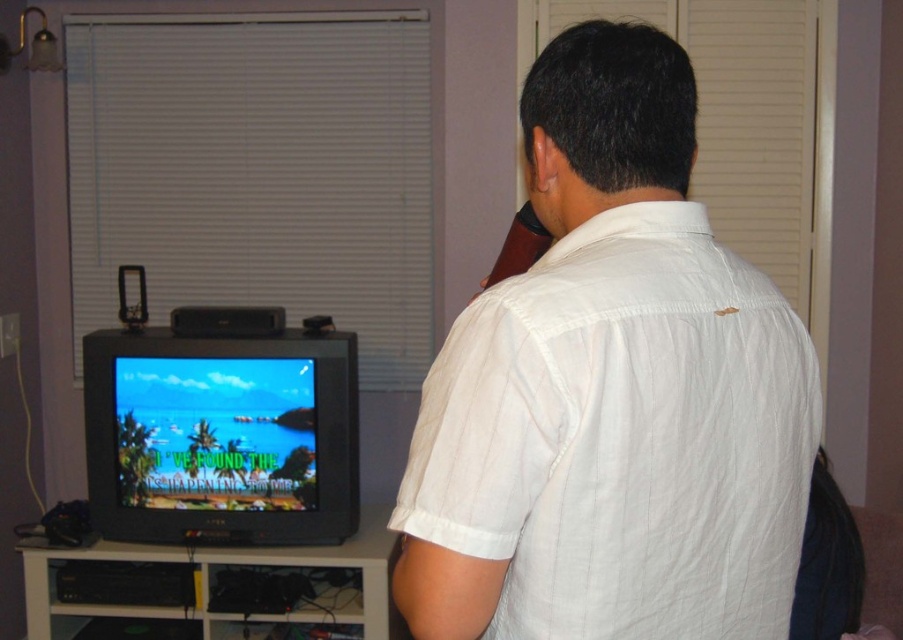
Is white cotton shirt at back bigger than white wood entertainment center at lower left?

Actually, white cotton shirt at back might be smaller than white wood entertainment center at lower left.

Between point (739, 275) and point (262, 634), which one is positioned behind?

The point (262, 634) is behind.

Is point (602, 342) positioned in front of point (275, 564)?

Yes, it is.

Where is `white cotton shirt at back`? The height and width of the screenshot is (640, 903). white cotton shirt at back is located at coordinates (622, 436).

Is shiny black tv at lower left behind white wood entertainment center at lower left?

Yes, shiny black tv at lower left is further from the viewer.

Describe the element at coordinates (221, 436) in the screenshot. The width and height of the screenshot is (903, 640). I see `shiny black tv at lower left` at that location.

Where is `shiny black tv at lower left`? Image resolution: width=903 pixels, height=640 pixels. shiny black tv at lower left is located at coordinates (221, 436).

Does point (618, 483) come closer to viewer compared to point (157, 355)?

Yes, it is in front of point (157, 355).

Where is `white cotton shirt at back`? This screenshot has width=903, height=640. white cotton shirt at back is located at coordinates [x=622, y=436].

In order to click on white cotton shirt at back in this screenshot , I will do `click(622, 436)`.